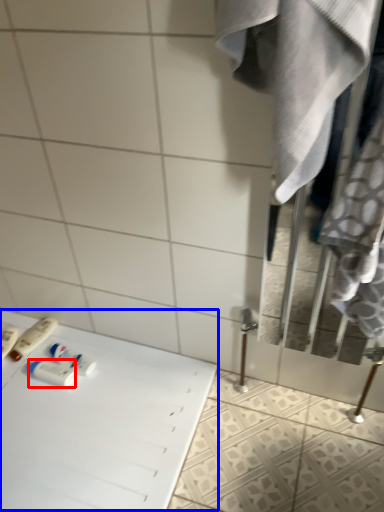
Question: Which object appears farthest to the camera in this image, toiletry (highlighted by a red box) or table (highlighted by a blue box)?

Choices:
 (A) toiletry
 (B) table

Answer: (A)